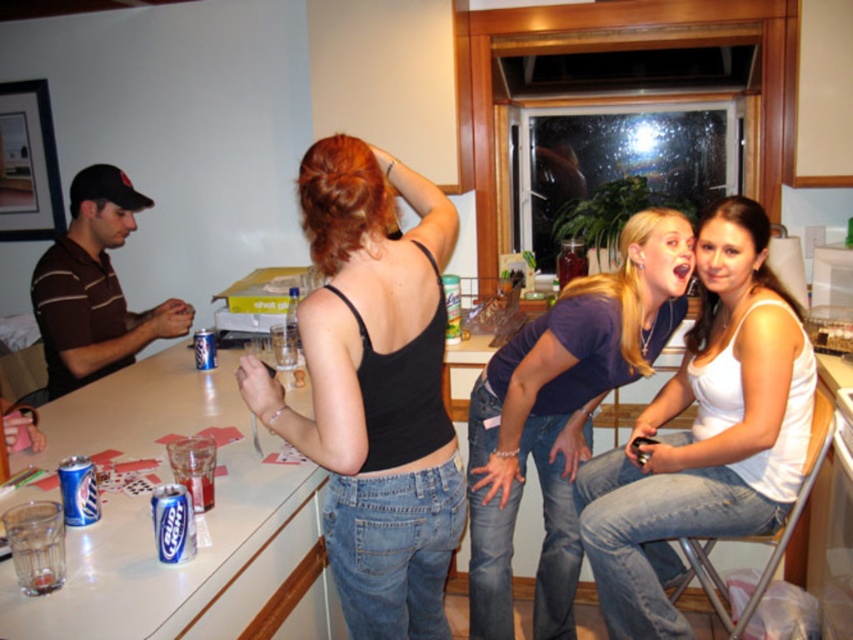
Question: Which point is farther from the camera taking this photo?

Choices:
 (A) (131, 209)
 (B) (367, 470)
 (C) (161, 513)
 (D) (631, 349)

Answer: (A)

Question: Which point appears closest to the camera in this image?

Choices:
 (A) (51, 570)
 (B) (189, 314)
 (C) (222, 504)

Answer: (A)

Question: Is metallic silver counter top at lower left bigger than blue metallic can at lower left?

Choices:
 (A) yes
 (B) no

Answer: (A)

Question: Can you confirm if white matte tank top at center is bigger than brown striped shirt at left?

Choices:
 (A) no
 (B) yes

Answer: (B)

Question: Among these objects, which one is farthest from the camera?

Choices:
 (A) blue metallic can at lower left
 (B) brown striped shirt at left
 (C) dark purple t-shirt at center

Answer: (B)

Question: Can you confirm if dark purple t-shirt at center is positioned to the left of brown striped shirt at left?

Choices:
 (A) yes
 (B) no

Answer: (B)